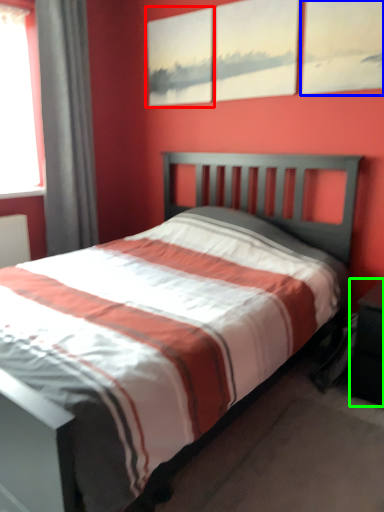
Question: Which object is positioned farthest from picture frame (highlighted by a red box)? Select from picture frame (highlighted by a blue box) and nightstand (highlighted by a green box).

Choices:
 (A) picture frame
 (B) nightstand

Answer: (B)